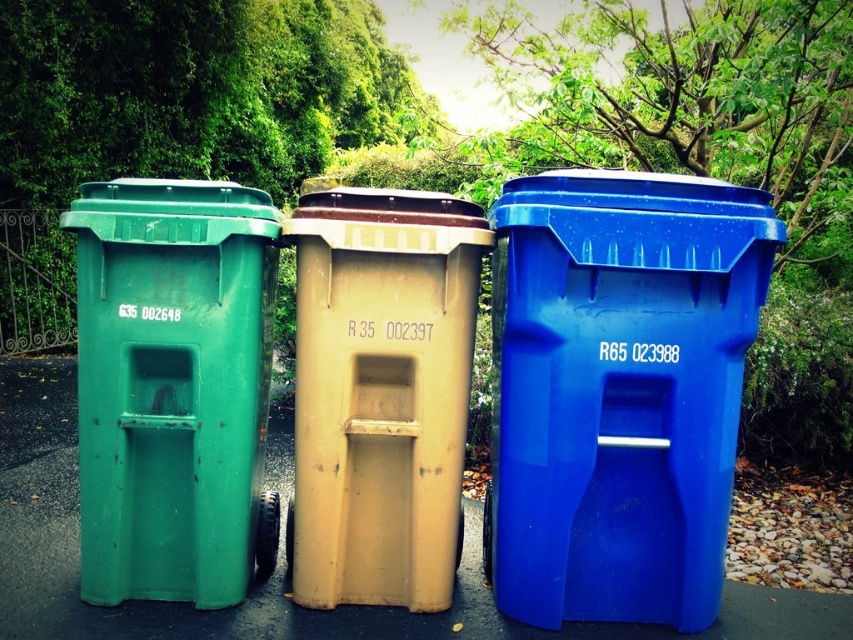
You are standing in front of the three recycling bins and want to place an object at the point closest to you. Which point should you choose between point (701, 584) and point (376, 392)?

Point (701, 584) is closer to the viewer than point (376, 392), so you should choose point (701, 584).

You are a waste collector who needs to empty the blue plastic bin at center and the green plastic bin at left. Which bin should you empty first if you want to follow the order from the closest to farthest from your current position?

The blue plastic bin at center is in front of the green plastic bin at left, so you should empty the blue plastic bin at center first as it is closer to you.